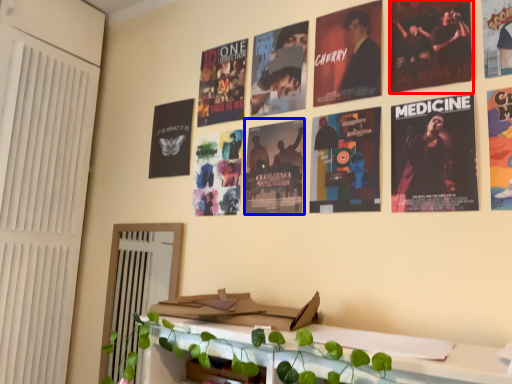
Question: Which point is further to the camera, poster (highlighted by a red box) or poster (highlighted by a blue box)?

Choices:
 (A) poster
 (B) poster

Answer: (B)